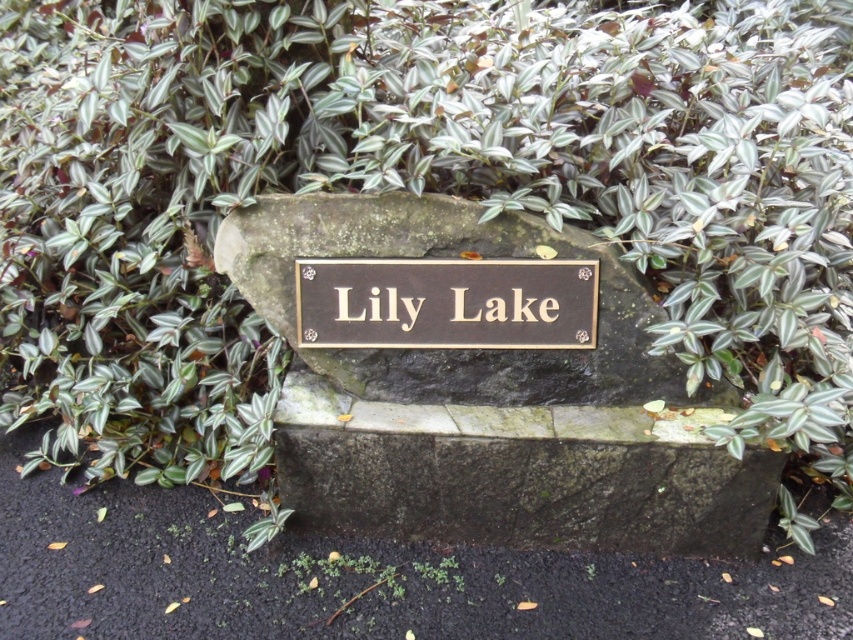
Based on the photo, does gold plated sign at center have a greater height compared to gold metallic plaque at center?

Yes.

Who is more distant from viewer, (563, 362) or (440, 268)?

The point (563, 362) is more distant.

Identify the location of gold plated sign at center. (491, 401).

Locate an element on the screen. gold plated sign at center is located at coordinates (491, 401).

Is point (544, 468) less distant than point (526, 300)?

That is True.

Between gold plated sign at center and gold metallic sign at center, which one appears on the left side from the viewer's perspective?

Positioned to the left is gold metallic sign at center.

Locate an element on the screen. gold plated sign at center is located at coordinates (491, 401).

Is gold metallic plaque at center to the left of gold metallic sign at center from the viewer's perspective?

Correct, you'll find gold metallic plaque at center to the left of gold metallic sign at center.

Who is more distant from viewer, (331, 337) or (469, 316)?

Point (331, 337)

This screenshot has height=640, width=853. I want to click on gold metallic plaque at center, so click(445, 301).